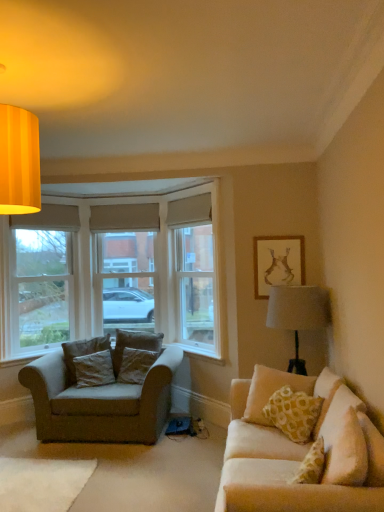
Image resolution: width=384 pixels, height=512 pixels. I want to click on vacant area that is in front of velvet beige armchair at left, so tap(110, 468).